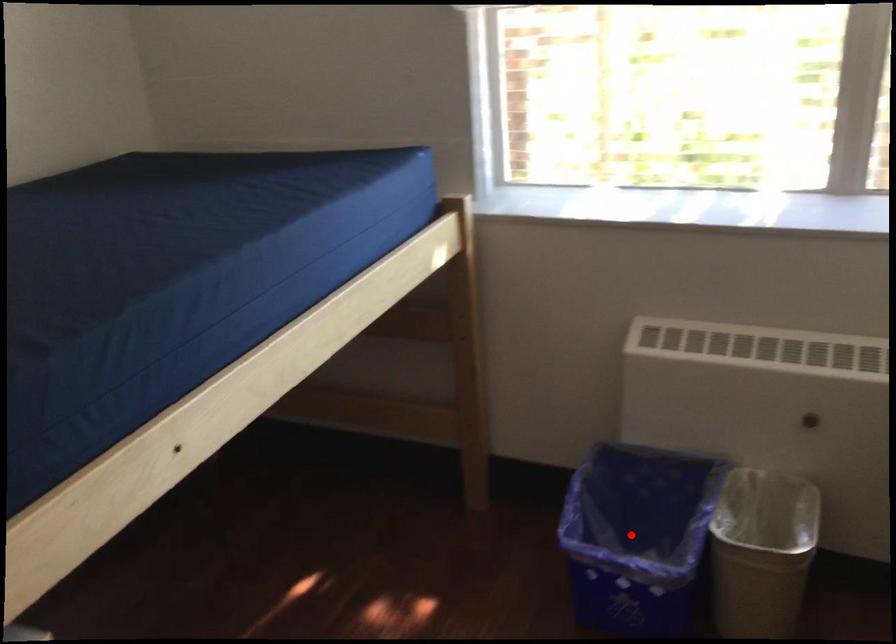
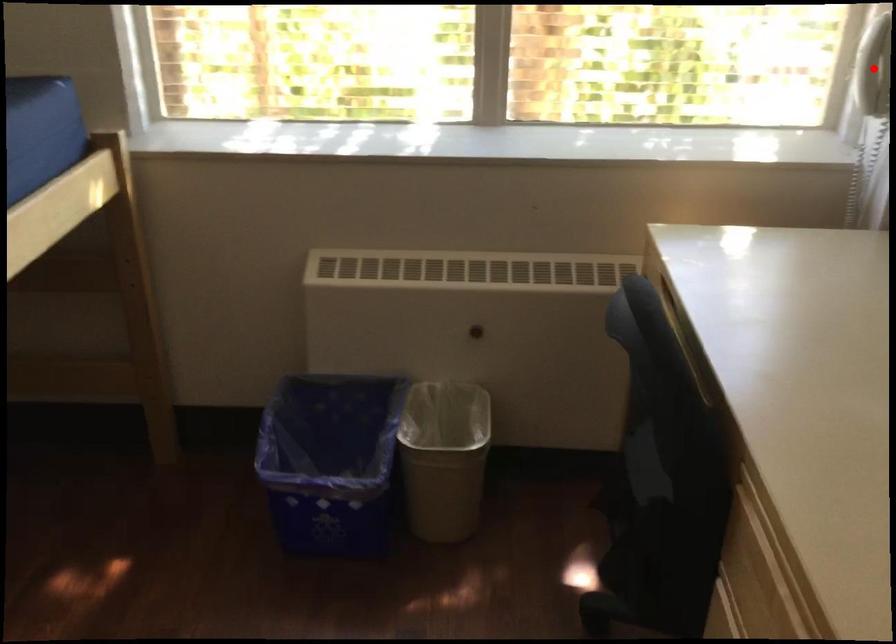
I am providing you with two images of the same scene from different viewpoints. A red point is marked on the first image and another point is marked on the second image. Do the highlighted points in image1 and image2 indicate the same real-world spot?

No